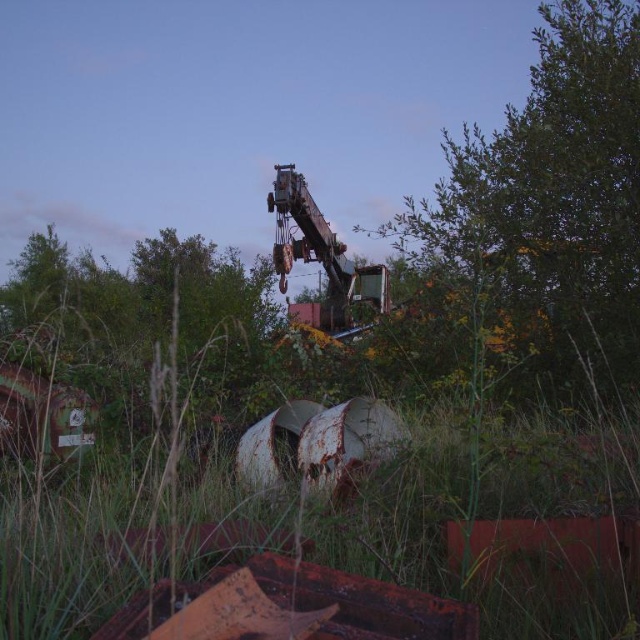
Can you confirm if green grass at center is wider than green leafy tree at upper right?

Yes, green grass at center is wider than green leafy tree at upper right.

Looking at this image, does green grass at center have a lesser width compared to green leafy tree at upper right?

No.

Who is more forward, [134,525] or [536,264]?

Point [134,525] is in front.

Locate an element on the screen. Image resolution: width=640 pixels, height=640 pixels. green grass at center is located at coordinates (470, 492).

Based on the photo, who is taller, green grass at center or green matte tree at center?

green matte tree at center

Is point (432, 472) positioned after point (17, 291)?

No, (432, 472) is closer to viewer.

The width and height of the screenshot is (640, 640). Identify the location of green grass at center. (470, 492).

Is point (580, 109) positioned after point (36, 289)?

No, (580, 109) is closer to viewer.

Find the location of a particular element. This screenshot has height=640, width=640. green leafy tree at upper right is located at coordinates (554, 195).

I want to click on green leafy tree at upper right, so click(554, 195).